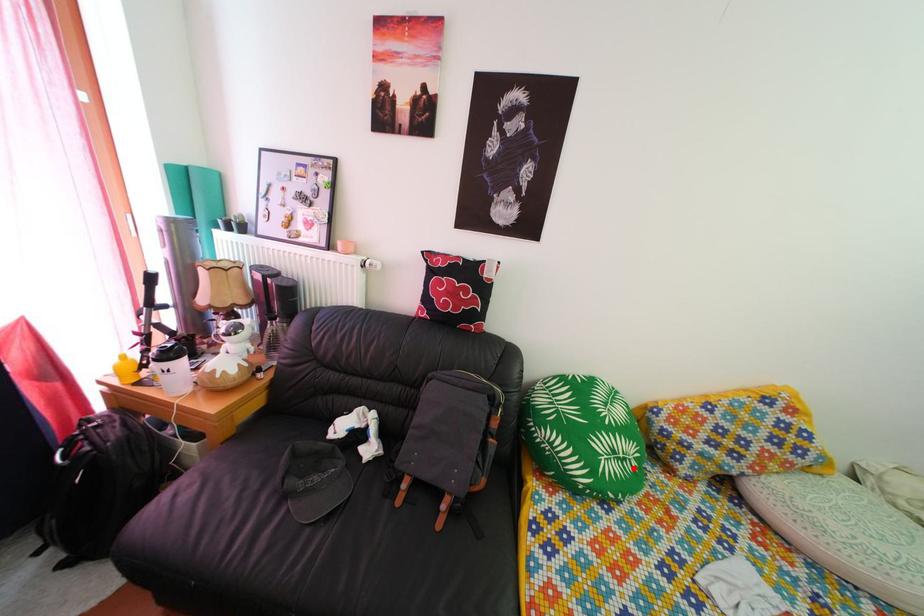
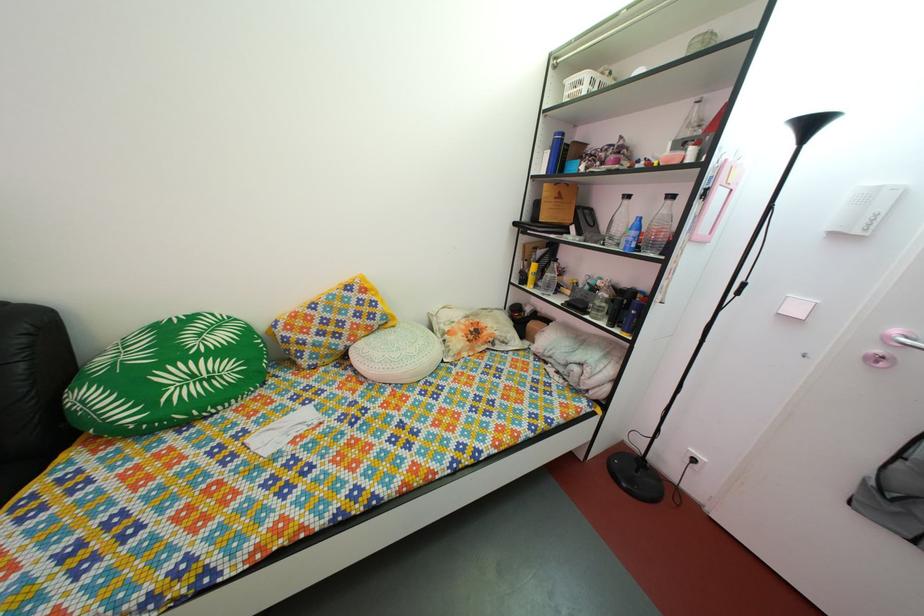
In the second image, find the point that corresponds to the highlighted location in the first image.

(220, 387)